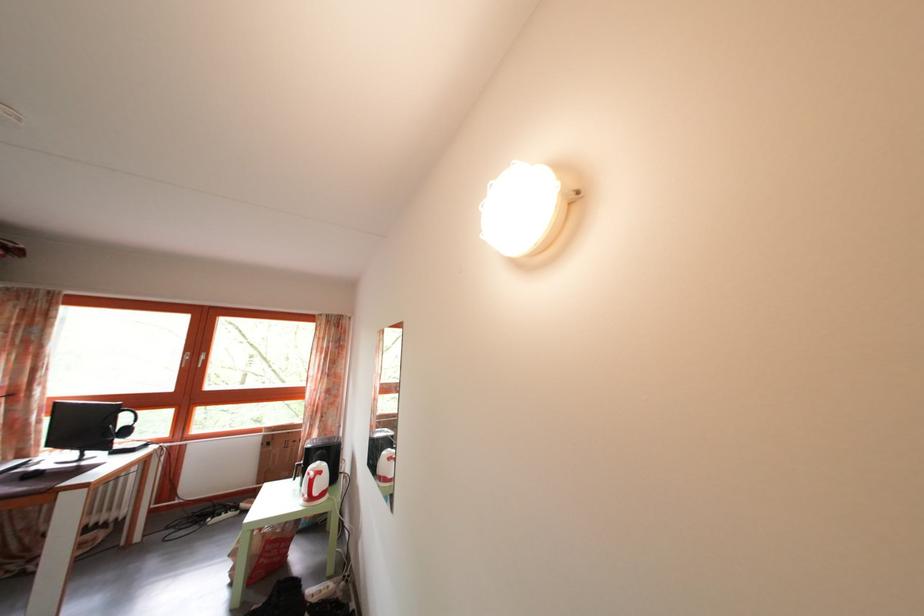
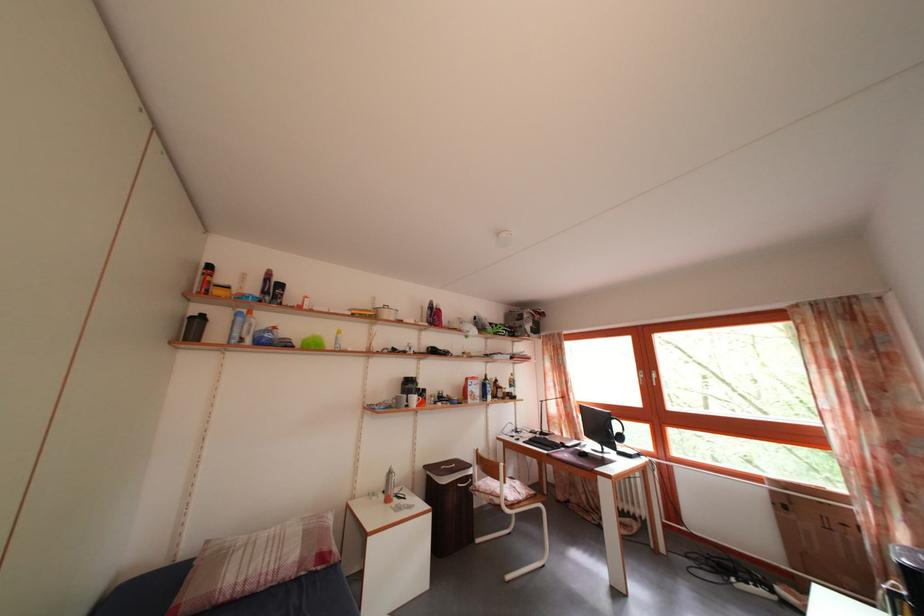
Locate, in the second image, the point that corresponds to the point at 132,427 in the first image.

(624, 434)